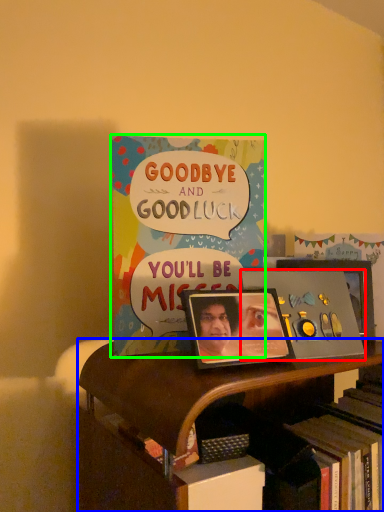
Question: Considering the real-world distances, which object is farthest from album cover (highlighted by a red box)? bookcase (highlighted by a blue box) or book (highlighted by a green box)?

Choices:
 (A) bookcase
 (B) book

Answer: (A)